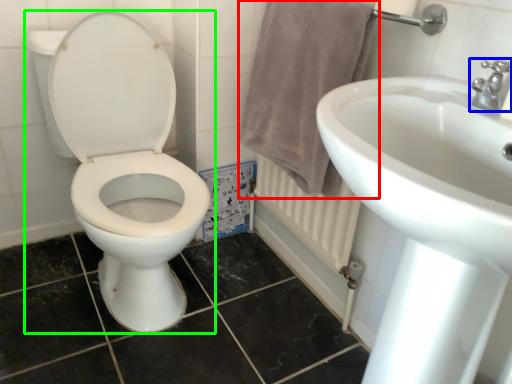
Question: Which object is positioned closest to bath towel (highlighted by a red box)? Select from tap (highlighted by a blue box) and toilet (highlighted by a green box).

Choices:
 (A) tap
 (B) toilet

Answer: (B)